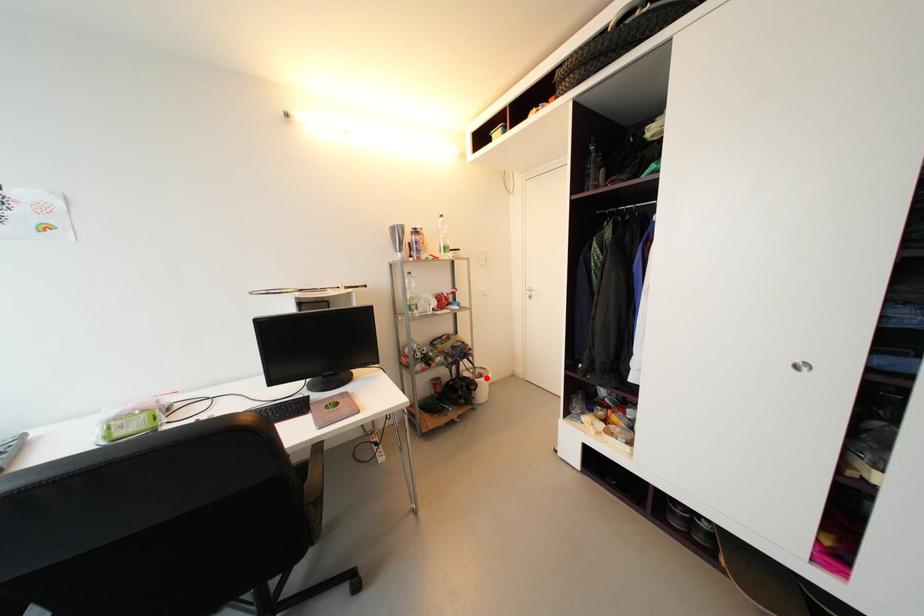
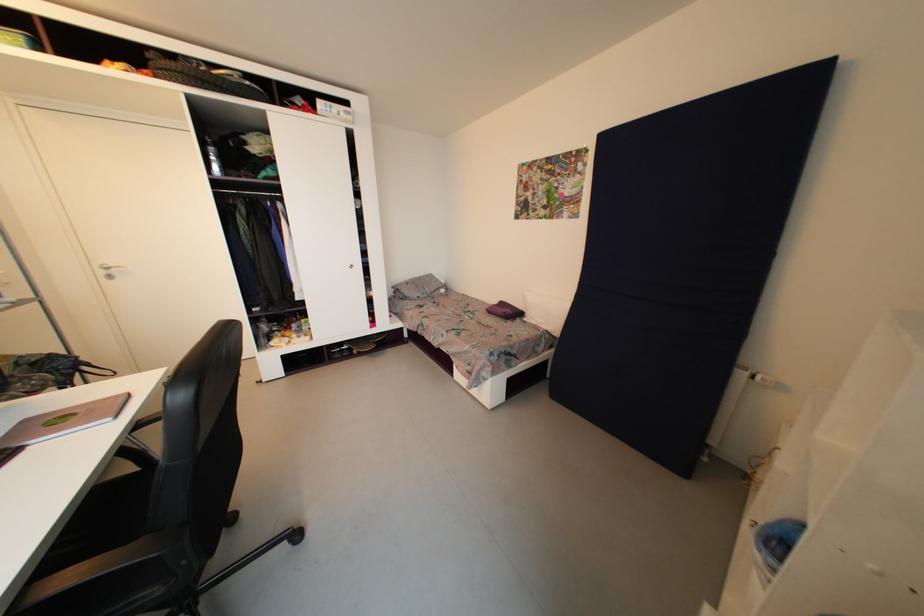
Question: I am providing you with two images of the same scene from different viewpoints. A red point is marked on the first image. Is the red point's position out of view in image 2?

Choices:
 (A) Yes
 (B) No

Answer: (A)